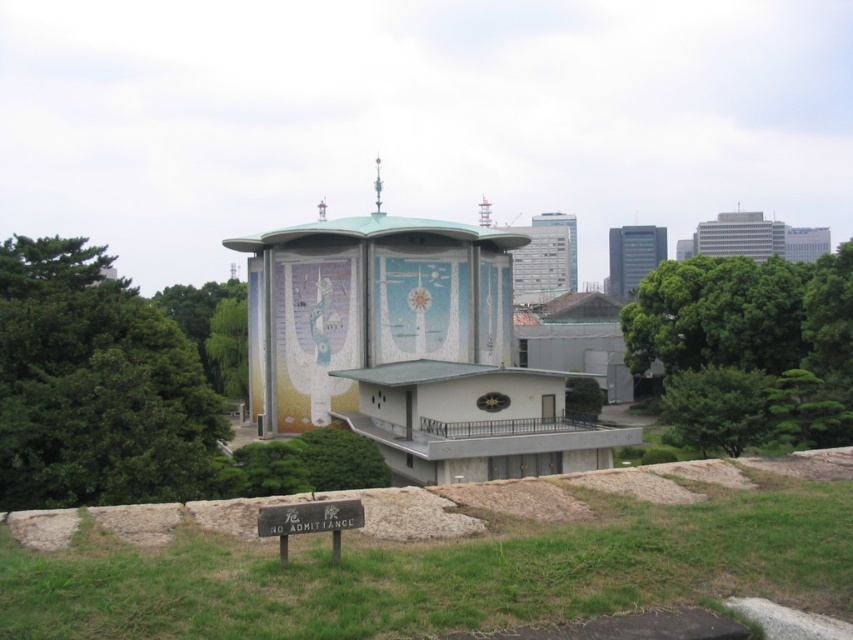
Question: Considering the relative positions of green leafy tree at right and smooth concrete tower at center in the image provided, where is green leafy tree at right located with respect to smooth concrete tower at center?

Choices:
 (A) below
 (B) above

Answer: (A)

Question: Which of the following is the closest to the observer?

Choices:
 (A) (143, 316)
 (B) (218, 296)
 (C) (555, 273)

Answer: (A)

Question: Can you confirm if green leafy tree at right is positioned to the right of smooth glass skyscraper at upper right?

Choices:
 (A) no
 (B) yes

Answer: (A)

Question: Can you confirm if green leafy tree at center is wider than smooth glass skyscraper at upper right?

Choices:
 (A) yes
 (B) no

Answer: (B)

Question: Which of the following is the farthest from the observer?

Choices:
 (A) smooth glass skyscraper at upper center
 (B) green leafy tree at center

Answer: (A)

Question: Which is farther from the green leafy tree at center?

Choices:
 (A) smooth glass skyscraper at upper right
 (B) green leafy tree at left

Answer: (A)